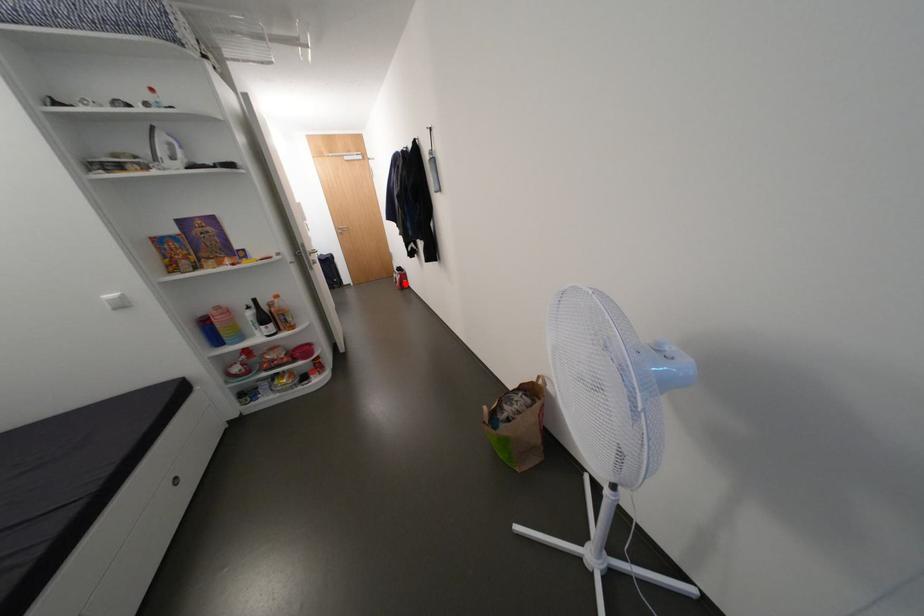
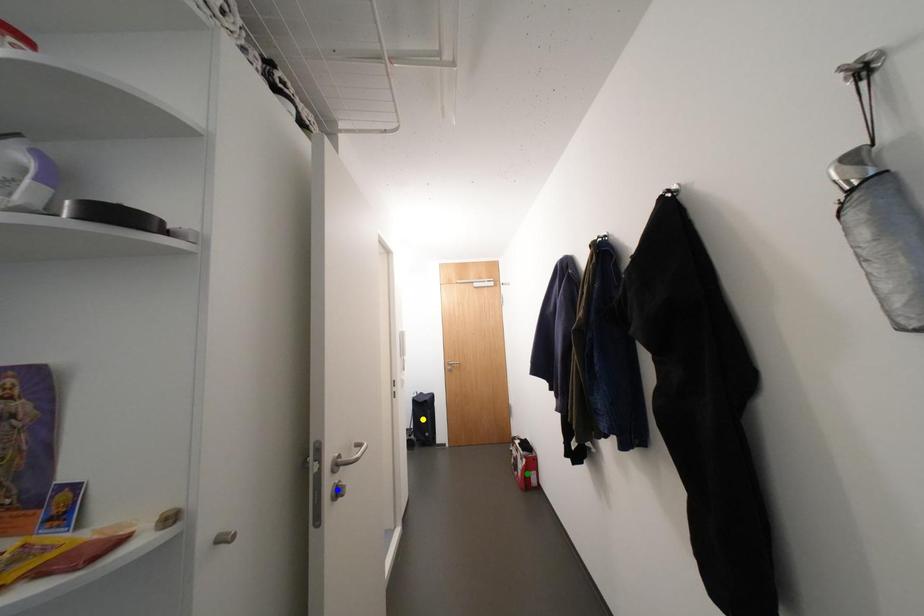
Question: I am providing you with two images of the same scene from different viewpoints. A red point is marked on the first image. You are given multiple points on the second image. Which point in image 2 represents the same 3d spot as the red point in image 1?

Choices:
 (A) green point
 (B) yellow point
 (C) blue point

Answer: (A)